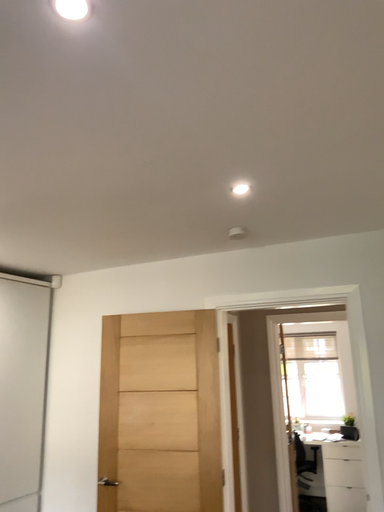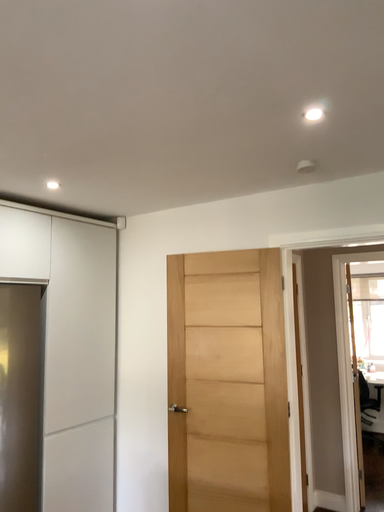
Question: How did the camera likely rotate when shooting the video?

Choices:
 (A) rotated downward
 (B) rotated upward

Answer: (A)